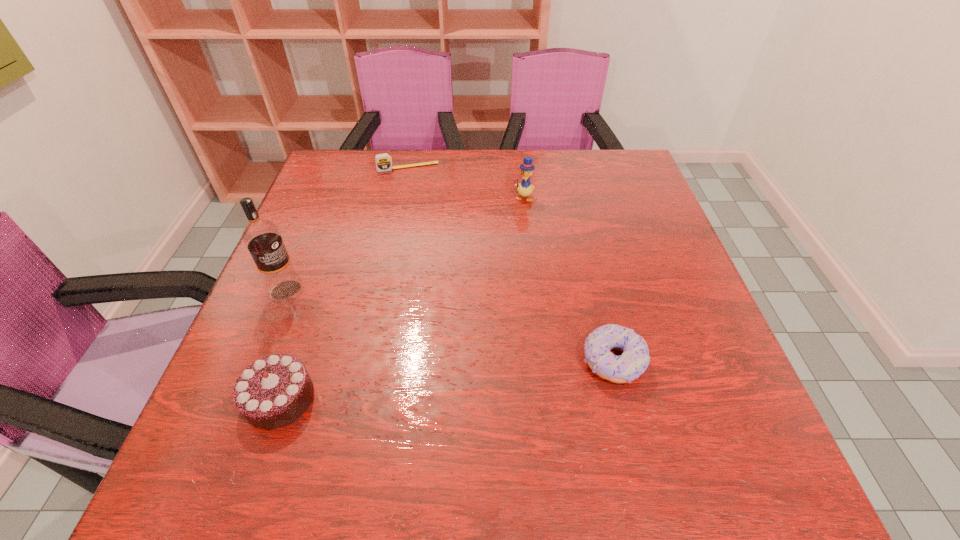
Locate an element on the screen. This screenshot has width=960, height=540. chocolate cake at the near edge is located at coordinates (274, 391).

Where is `doughnut situated at the near edge`? doughnut situated at the near edge is located at coordinates (633, 362).

Locate an element on the screen. The image size is (960, 540). chocolate cake that is at the left edge is located at coordinates (274, 391).

I want to click on vodka at the left edge, so click(x=262, y=237).

You are a GUI agent. You are given a task and a screenshot of the screen. Output one action in this format:
    pyautogui.click(x=<x>, y=<y>)
    Task: Click on the tape measure situated at the left edge
    
    Given the screenshot: What is the action you would take?
    pyautogui.click(x=383, y=161)

Locate an element on the screen. object at the right edge is located at coordinates (633, 362).

You are a GUI agent. You are given a task and a screenshot of the screen. Output one action in this format:
    pyautogui.click(x=<x>, y=<y>)
    Task: Click on the object at the far left corner
    The height and width of the screenshot is (540, 960).
    Given the screenshot: What is the action you would take?
    pyautogui.click(x=383, y=161)

Locate an element on the screen. This screenshot has height=540, width=960. object at the near left corner is located at coordinates (274, 391).

Locate an element on the screen. The width and height of the screenshot is (960, 540). object present at the near right corner is located at coordinates (633, 362).

Locate an element on the screen. free space at the far edge is located at coordinates (412, 170).